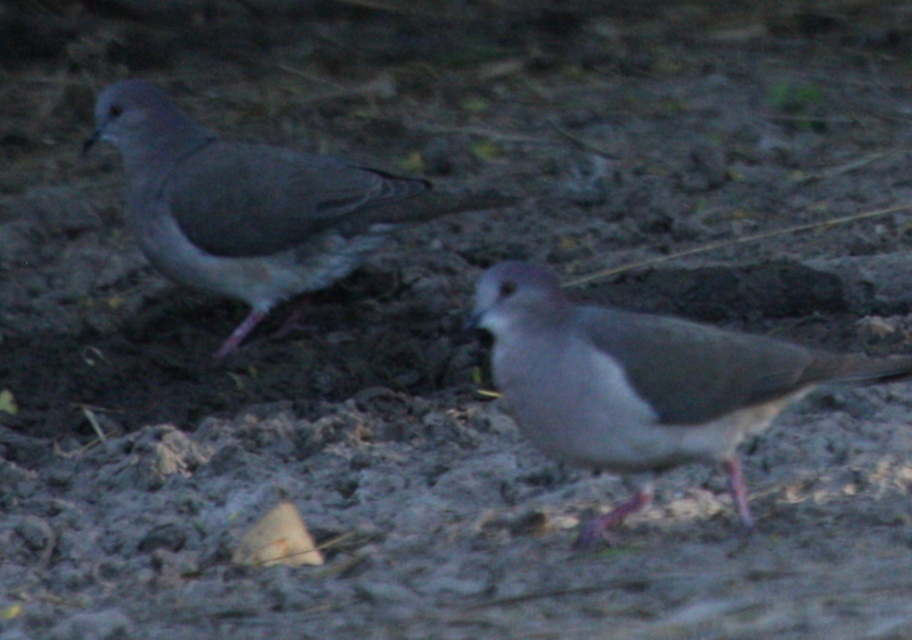
In the scene shown: How distant is gray matte dove at center from gray matte dove at left?

A distance of 1.23 meters exists between gray matte dove at center and gray matte dove at left.

The image size is (912, 640). What do you see at coordinates (641, 381) in the screenshot?
I see `gray matte dove at center` at bounding box center [641, 381].

Where is `gray matte dove at center`? gray matte dove at center is located at coordinates (641, 381).